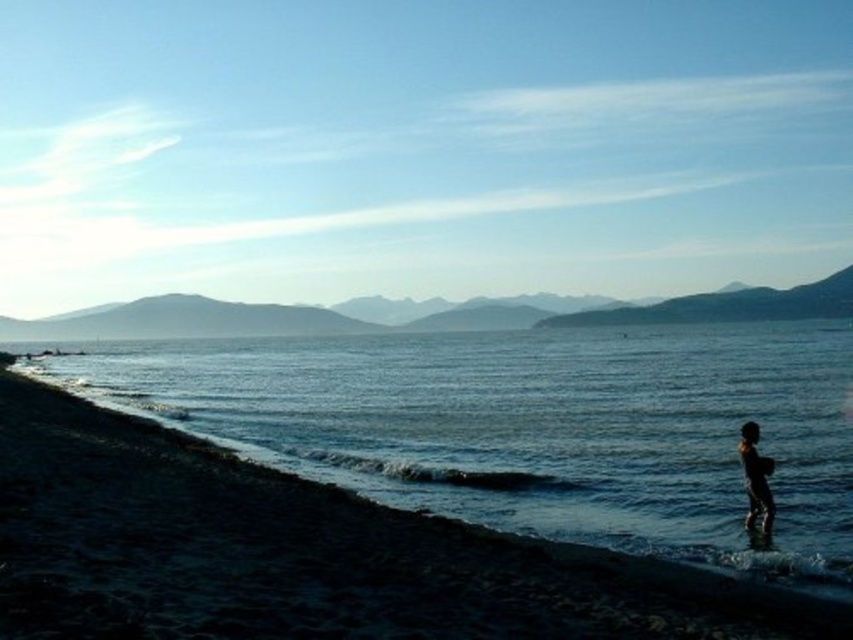
Does dark blue water at lower left have a greater width compared to dark skin human at lower right?

Indeed, dark blue water at lower left has a greater width compared to dark skin human at lower right.

Does point (776, 381) come in front of point (764, 484)?

No, it is not.

Where is `dark blue water at lower left`? dark blue water at lower left is located at coordinates (531, 426).